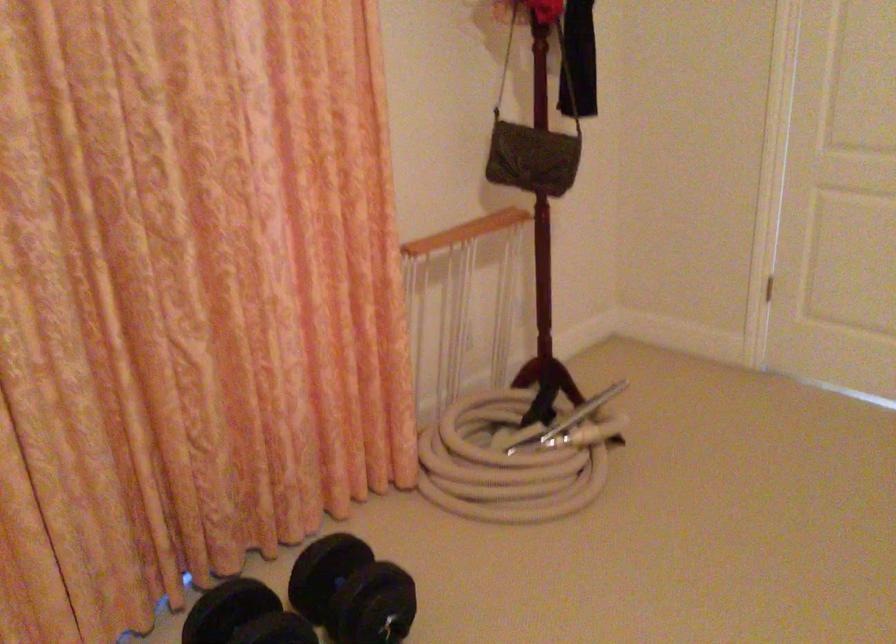
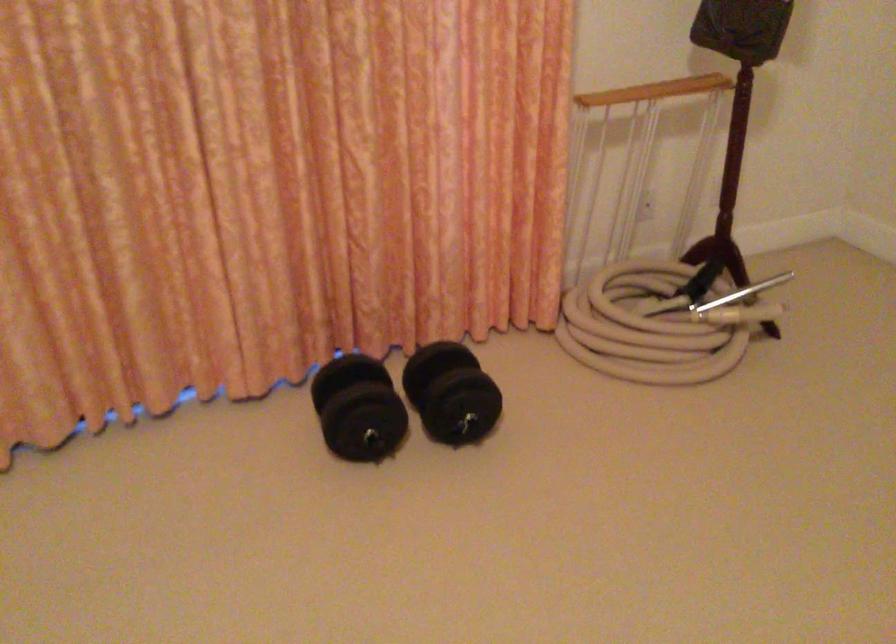
The point at [513,266] is marked in the first image. Where is the corresponding point in the second image?

(719, 137)